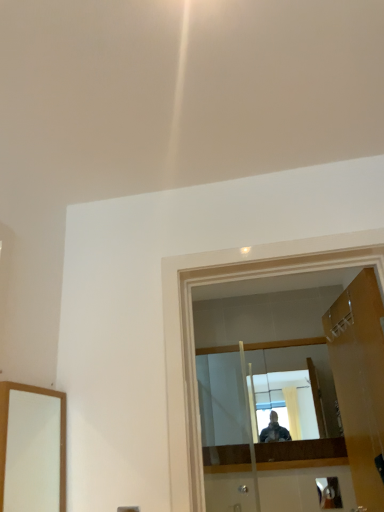
Question: From a real-world perspective, is transparent glass door at center over wooden door at right?

Choices:
 (A) no
 (B) yes

Answer: (B)

Question: Is wooden door at right at the back of transparent glass door at center?

Choices:
 (A) yes
 (B) no

Answer: (A)

Question: Can you confirm if transparent glass door at center is taller than wooden door at right?

Choices:
 (A) yes
 (B) no

Answer: (B)

Question: Is transparent glass door at center to the left of wooden door at right from the viewer's perspective?

Choices:
 (A) no
 (B) yes

Answer: (B)

Question: From the image's perspective, is transparent glass door at center on top of wooden door at right?

Choices:
 (A) yes
 (B) no

Answer: (A)

Question: In the image, is metallic silver door handle at lower right on the left side or the right side of transparent glass door at center?

Choices:
 (A) left
 (B) right

Answer: (B)

Question: From a real-world perspective, is metallic silver door handle at lower right physically located above or below transparent glass door at center?

Choices:
 (A) below
 (B) above

Answer: (A)

Question: Is metallic silver door handle at lower right taller or shorter than transparent glass door at center?

Choices:
 (A) tall
 (B) short

Answer: (B)

Question: Looking at the image, does metallic silver door handle at lower right seem bigger or smaller compared to transparent glass door at center?

Choices:
 (A) big
 (B) small

Answer: (B)

Question: Visually, is wooden door at right positioned to the left or to the right of transparent glass door at center?

Choices:
 (A) right
 (B) left

Answer: (A)

Question: Is wooden door at right wider or thinner than transparent glass door at center?

Choices:
 (A) wide
 (B) thin

Answer: (B)

Question: Does point (332, 344) appear closer or farther from the camera than point (185, 288)?

Choices:
 (A) closer
 (B) farther

Answer: (B)

Question: Is wooden door at right in front of or behind transparent glass door at center in the image?

Choices:
 (A) front
 (B) behind

Answer: (B)

Question: From a real-world perspective, is transparent glass door at center above or below metallic silver door handle at lower right?

Choices:
 (A) above
 (B) below

Answer: (A)

Question: Considering the positions of transparent glass door at center and metallic silver door handle at lower right in the image, is transparent glass door at center taller or shorter than metallic silver door handle at lower right?

Choices:
 (A) short
 (B) tall

Answer: (B)